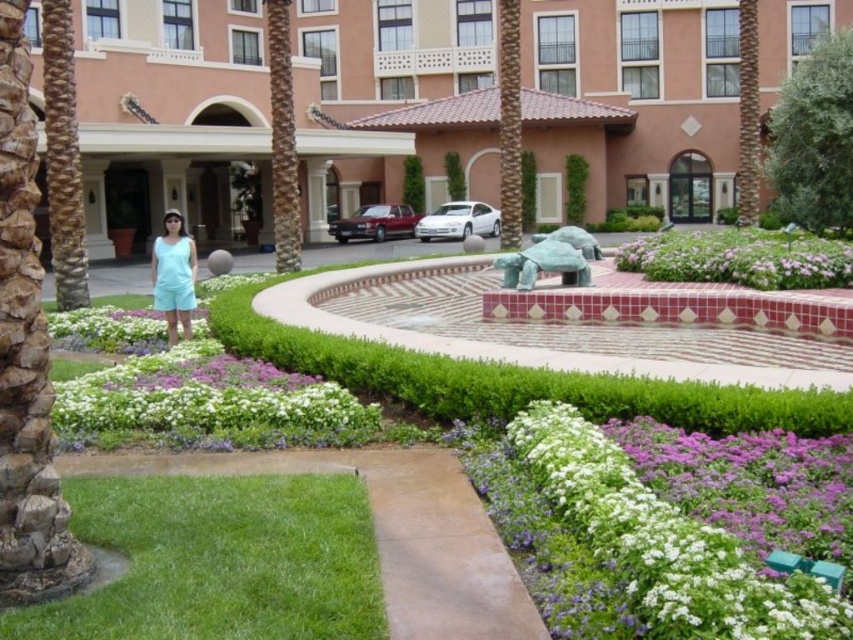
Which is behind, point (506, 136) or point (177, 276)?

Point (506, 136)

Is point (506, 49) behind point (190, 292)?

Yes, point (506, 49) is behind point (190, 292).

The image size is (853, 640). In order to click on brown textured palm tree at center in this screenshot , I will do `click(509, 122)`.

Consider the image. Between light blue fabric shorts at center and light blue fabric dress at center, which one is positioned lower?

light blue fabric dress at center is lower down.

Is light blue fabric shorts at center bigger than light blue fabric dress at center?

Correct, light blue fabric shorts at center is larger in size than light blue fabric dress at center.

Who is more forward, (x=173, y=218) or (x=155, y=264)?

Positioned in front is point (x=155, y=264).

Identify the location of light blue fabric shorts at center. (173, 275).

Consider the image. Is green textured palm tree at center positioned behind brown textured palm tree at upper right?

No.

Between green textured palm tree at center and brown textured palm tree at upper right, which one has more height?

Standing taller between the two is green textured palm tree at center.

Where is `green textured palm tree at center`? This screenshot has height=640, width=853. green textured palm tree at center is located at coordinates (282, 140).